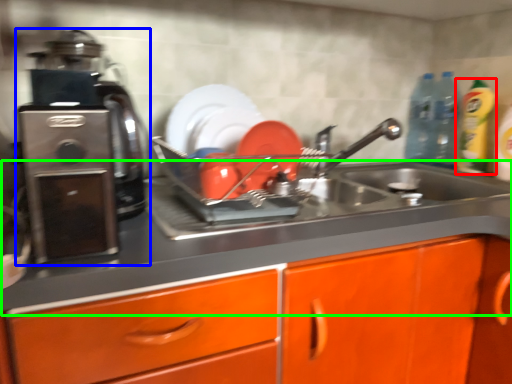
Question: Which is farther away from cleaning product (highlighted by a red box)? home appliance (highlighted by a blue box) or counter top (highlighted by a green box)?

Choices:
 (A) home appliance
 (B) counter top

Answer: (A)